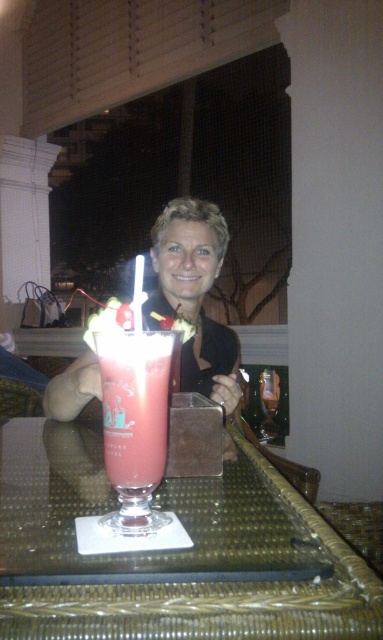
Who is taller, matte pink glass at center or matte black dress at center?

With more height is matte black dress at center.

Measure the distance between point (162,444) and camera.

Point (162,444) is 26.30 inches from camera.

Is point (103, 410) closer to viewer compared to point (173, 268)?

Yes, point (103, 410) is in front of point (173, 268).

You are a GUI agent. You are given a task and a screenshot of the screen. Output one action in this format:
    pyautogui.click(x=<x>, y=<y>)
    Task: Click on the matte pink glass at center
    The image size is (383, 640).
    Given the screenshot: What is the action you would take?
    pyautogui.click(x=134, y=406)

Can you confirm if matte black dress at center is wider than translucent pink smoothie at center?

Yes.

Does point (198, 227) come farther from viewer compared to point (142, 381)?

Yes.

Image resolution: width=383 pixels, height=640 pixels. In order to click on matte black dress at center in this screenshot , I will do `click(194, 296)`.

Can you confirm if clear glass table at center is positioned to the left of translucent pink smoothie at center?

Indeed, clear glass table at center is positioned on the left side of translucent pink smoothie at center.

Does clear glass table at center have a lesser height compared to translucent pink smoothie at center?

Yes.

Who is more distant from viewer, (207,484) or (127,404)?

The point (207,484) is more distant.

At what (x,y) coordinates should I click in order to perform the action: click on clear glass table at center. Please return your answer as a coordinate pair (x, y). This screenshot has width=383, height=640. Looking at the image, I should click on (222, 580).